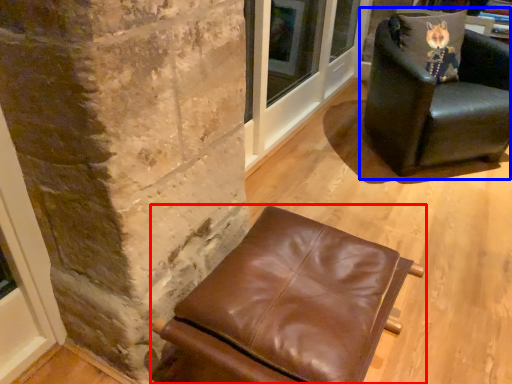
Question: Which object appears farthest to the camera in this image, chair (highlighted by a red box) or chair (highlighted by a blue box)?

Choices:
 (A) chair
 (B) chair

Answer: (B)